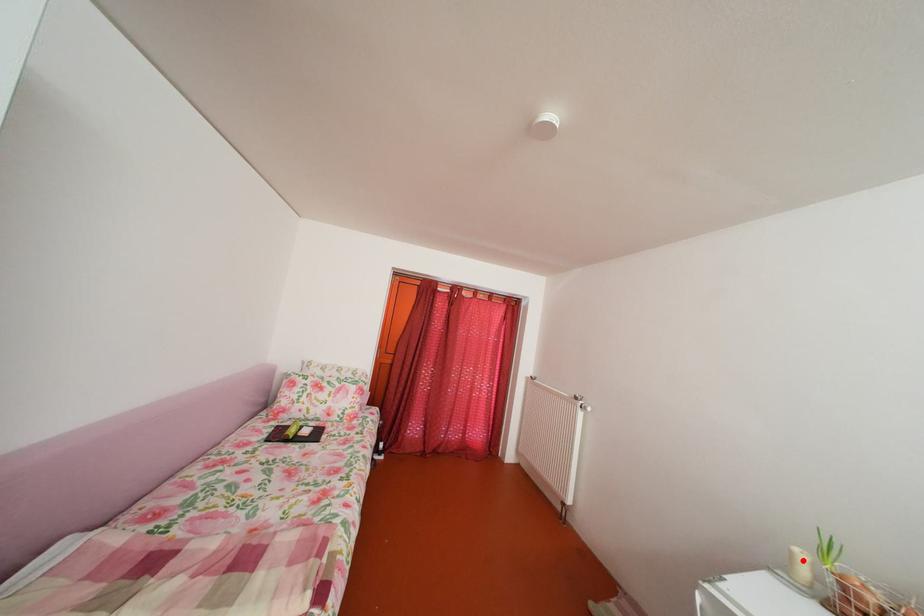
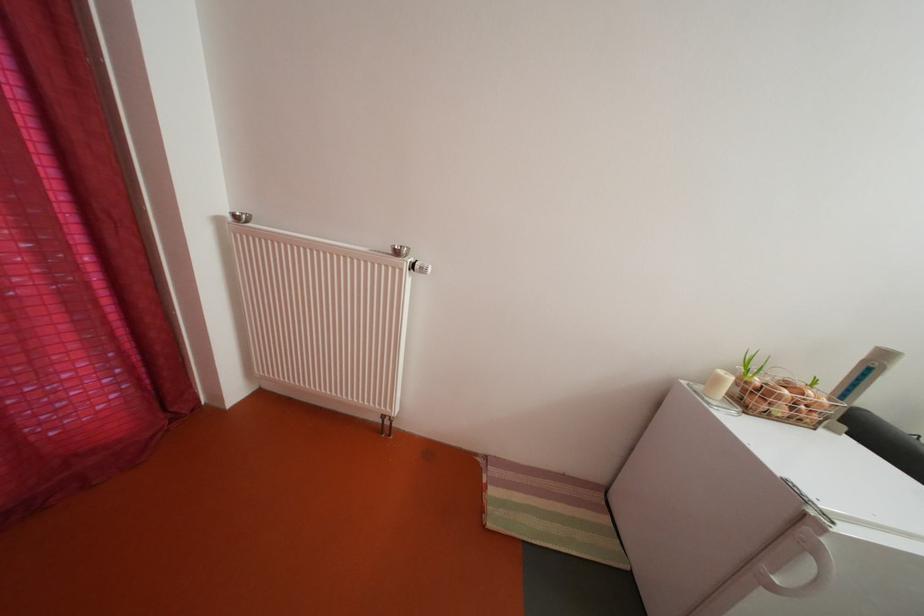
Locate, in the second image, the point that corresponds to the highlighted location in the first image.

(728, 386)